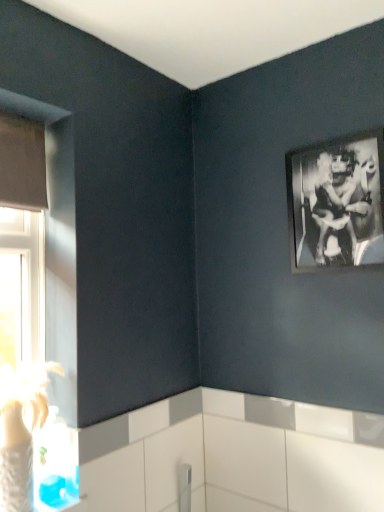
Question: From the image's perspective, is matte gray window at left above black matte picture frame at upper right?

Choices:
 (A) yes
 (B) no

Answer: (B)

Question: Is matte gray window at left positioned beyond the bounds of black matte picture frame at upper right?

Choices:
 (A) no
 (B) yes

Answer: (B)

Question: Is the position of matte gray window at left more distant than that of black matte picture frame at upper right?

Choices:
 (A) no
 (B) yes

Answer: (A)

Question: Considering the relative sizes of matte gray window at left and black matte picture frame at upper right in the image provided, is matte gray window at left wider than black matte picture frame at upper right?

Choices:
 (A) no
 (B) yes

Answer: (B)

Question: Is black matte picture frame at upper right at the back of matte gray window at left?

Choices:
 (A) yes
 (B) no

Answer: (B)

Question: Is matte gray window at left positioned far away from black matte picture frame at upper right?

Choices:
 (A) no
 (B) yes

Answer: (B)

Question: From a real-world perspective, is black matte picture frame at upper right under matte gray window at left?

Choices:
 (A) no
 (B) yes

Answer: (A)

Question: Is black matte picture frame at upper right facing away from matte gray window at left?

Choices:
 (A) yes
 (B) no

Answer: (B)

Question: From the image's perspective, does black matte picture frame at upper right appear lower than matte gray window at left?

Choices:
 (A) no
 (B) yes

Answer: (A)

Question: Considering the relative positions of black matte picture frame at upper right and matte gray window at left in the image provided, is black matte picture frame at upper right to the right of matte gray window at left from the viewer's perspective?

Choices:
 (A) yes
 (B) no

Answer: (A)

Question: Does black matte picture frame at upper right have a smaller size compared to matte gray window at left?

Choices:
 (A) yes
 (B) no

Answer: (A)

Question: Considering the relative sizes of black matte picture frame at upper right and matte gray window at left in the image provided, is black matte picture frame at upper right thinner than matte gray window at left?

Choices:
 (A) no
 (B) yes

Answer: (B)

Question: Based on their positions, is black matte picture frame at upper right located to the left or right of matte gray window at left?

Choices:
 (A) left
 (B) right

Answer: (B)